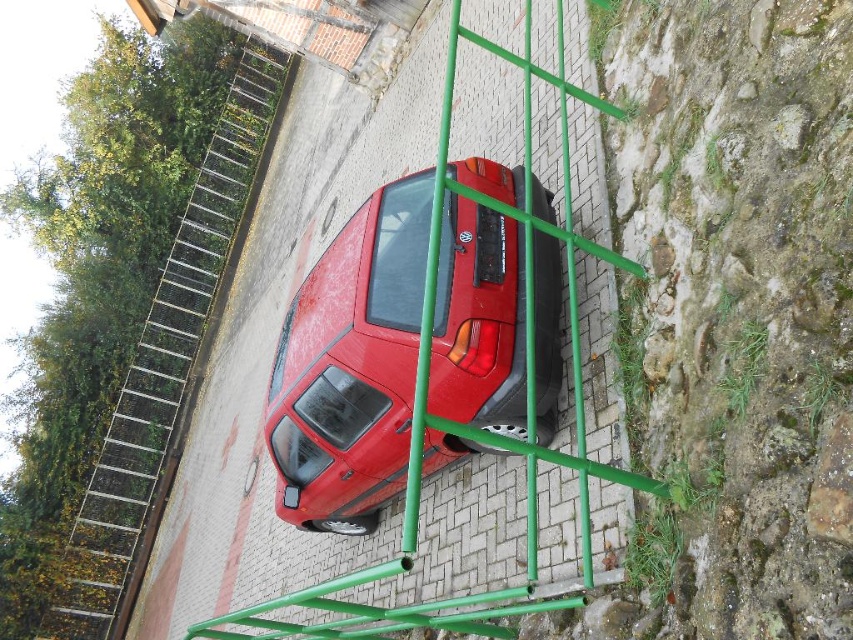
Does glossy red car at center appear under green metal ladder at center?

No, glossy red car at center is not below green metal ladder at center.

Is point (503, 262) farther from viewer compared to point (416, 524)?

Yes, it is behind point (416, 524).

In order to click on glossy red car at center in this screenshot , I will do `click(351, 365)`.

Who is positioned more to the right, glossy red car at center or metallic silver ladder at upper left?

Positioned to the right is glossy red car at center.

This screenshot has height=640, width=853. Describe the element at coordinates (351, 365) in the screenshot. I see `glossy red car at center` at that location.

The width and height of the screenshot is (853, 640). I want to click on glossy red car at center, so click(x=351, y=365).

What do you see at coordinates (462, 420) in the screenshot?
I see `green metal ladder at center` at bounding box center [462, 420].

Can you confirm if green metal ladder at center is positioned below metallic silver ladder at upper left?

Yes.

Which is behind, point (523, 93) or point (229, 200)?

The point (229, 200) is more distant.

The width and height of the screenshot is (853, 640). In order to click on green metal ladder at center in this screenshot , I will do `click(462, 420)`.